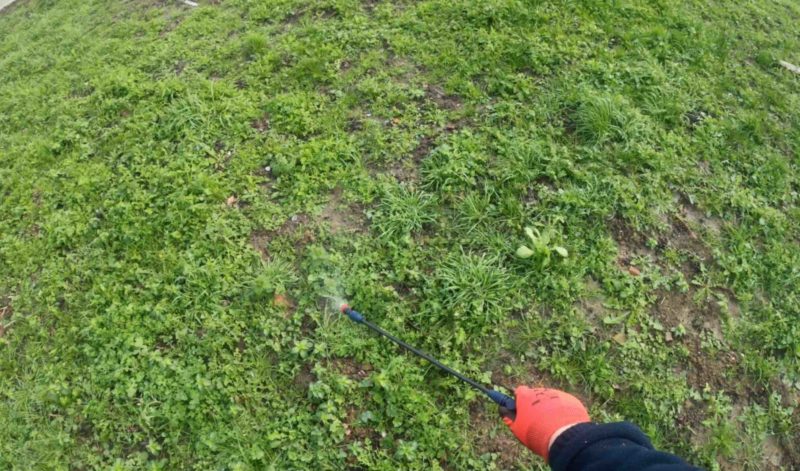
You are a GUI agent. You are given a task and a screenshot of the screen. Output one action in this format:
    pyautogui.click(x=<x>, y=<y>)
    Task: Click on the plant
    
    Given the screenshot: What is the action you would take?
    pyautogui.click(x=546, y=247)